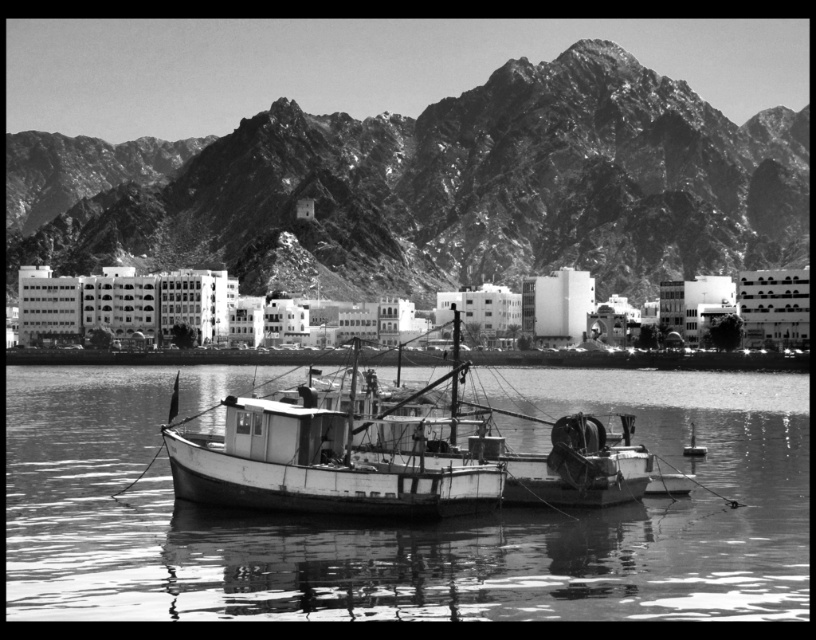
Question: Is smooth white water at center below white wooden boat at center?

Choices:
 (A) no
 (B) yes

Answer: (B)

Question: Which object is farther from the camera taking this photo?

Choices:
 (A) white wooden boat at center
 (B) smooth white water at center

Answer: (A)

Question: Considering the relative positions of rugged stone mountain at upper center and smooth white water at center in the image provided, where is rugged stone mountain at upper center located with respect to smooth white water at center?

Choices:
 (A) above
 (B) below

Answer: (A)

Question: Estimate the real-world distances between objects in this image. Which object is farther from the smooth white water at center?

Choices:
 (A) white wooden boat at center
 (B) rugged stone mountain at upper center

Answer: (B)

Question: Which object is the closest to the rugged stone mountain at upper center?

Choices:
 (A) smooth white water at center
 (B) white wooden boat at center

Answer: (B)

Question: Does rugged stone mountain at upper center appear on the right side of smooth white water at center?

Choices:
 (A) no
 (B) yes

Answer: (A)